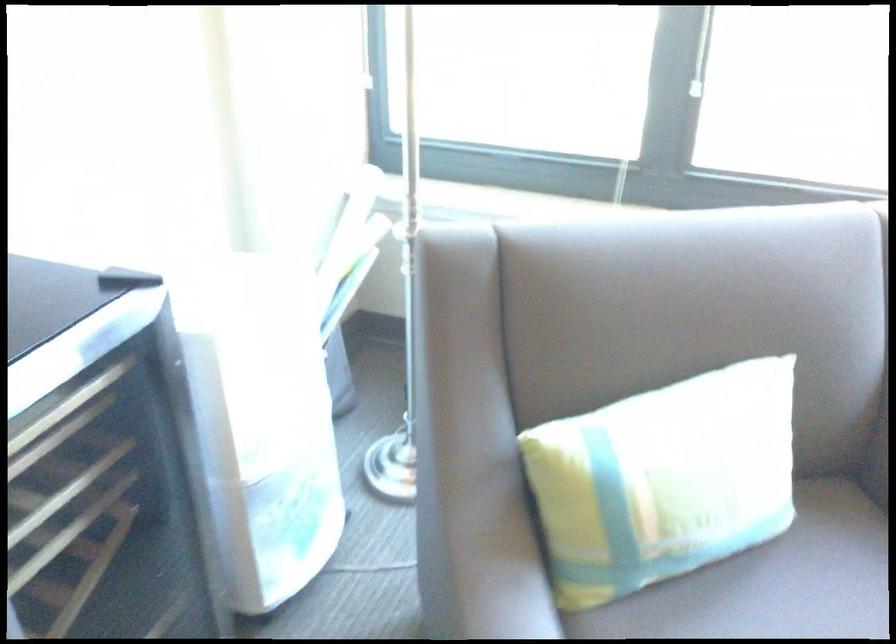
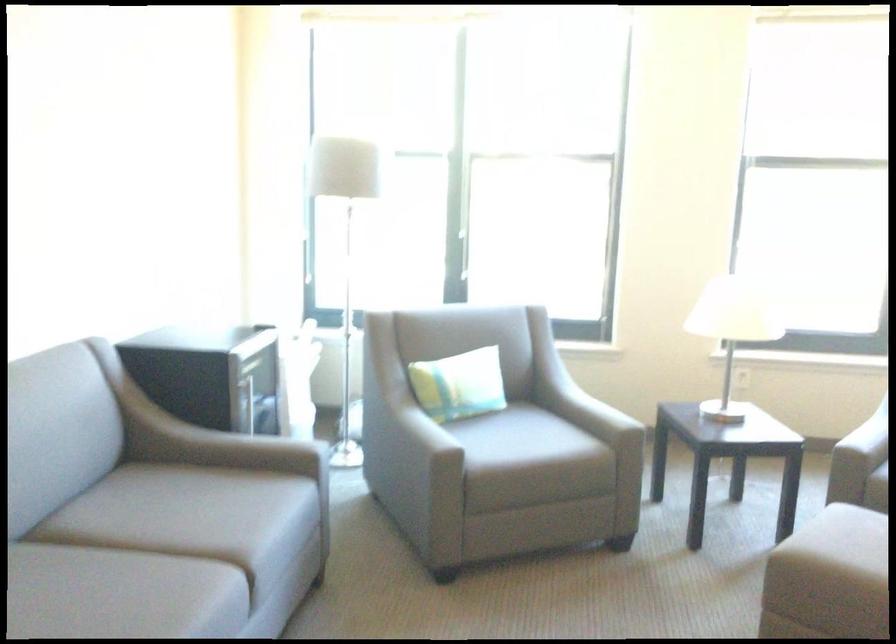
Find the pixel in the second image that matches point 791,502 in the first image.

(459, 384)